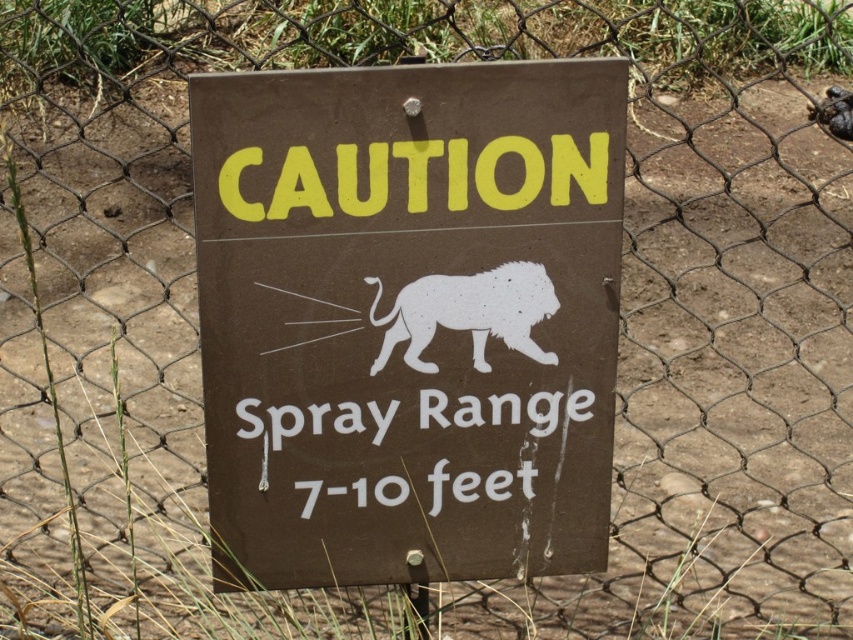
From the picture: Who is taller, brown matte sign at center or white matte lion at center?

brown matte sign at center

Describe the element at coordinates (408, 320) in the screenshot. This screenshot has width=853, height=640. I see `brown matte sign at center` at that location.

Does point (277, 573) lie behind point (480, 348)?

That is True.

Identify the location of brown matte sign at center. (408, 320).